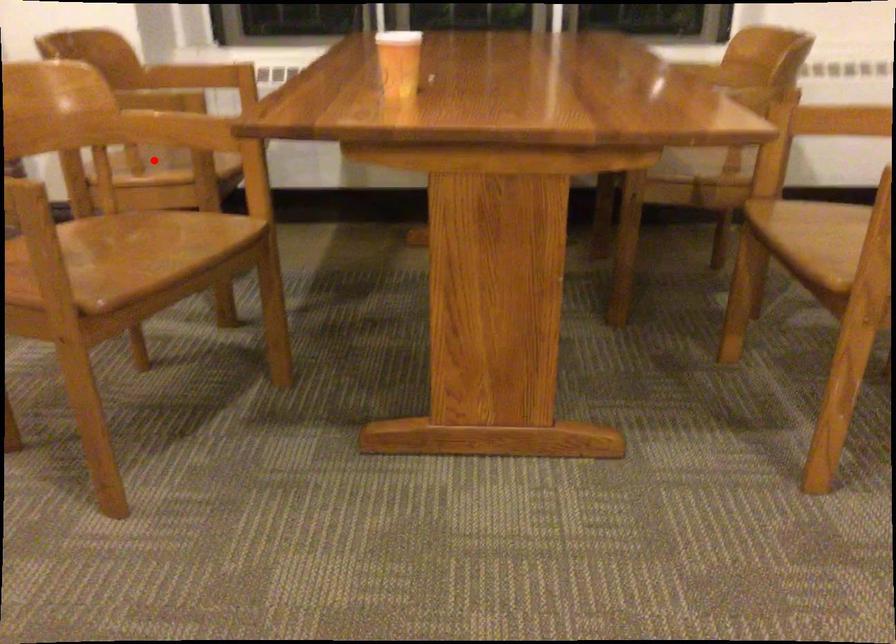
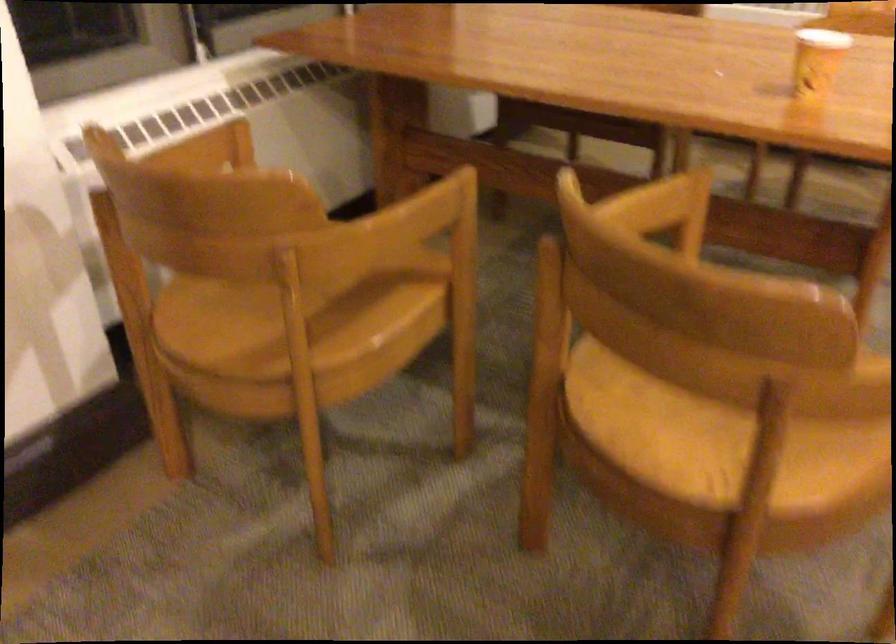
Locate, in the second image, the point that corresponds to the highlighted location in the first image.

(304, 297)